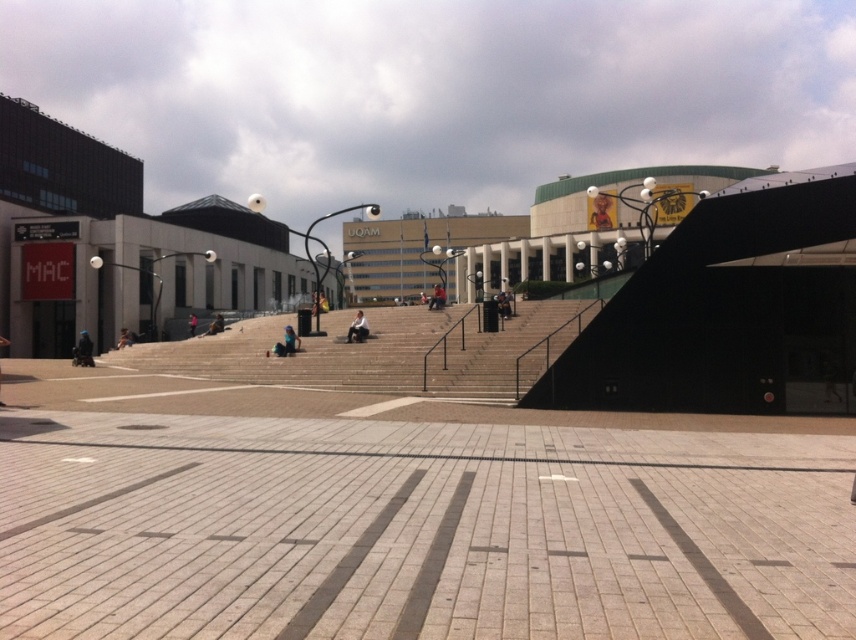
Who is positioned more to the right, dark blue jeans at center or dark blue jeans at lower left?

From the viewer's perspective, dark blue jeans at center appears more on the right side.

Is the position of dark blue jeans at center less distant than that of dark blue jeans at lower left?

Yes, it is.

The height and width of the screenshot is (640, 856). I want to click on dark blue jeans at center, so click(x=503, y=305).

Can you confirm if red fabric jacket at center is positioned above dark blue jeans at lower left?

Yes.

Can you confirm if red fabric jacket at center is positioned below dark blue jeans at lower left?

Actually, red fabric jacket at center is above dark blue jeans at lower left.

Which is behind, point (441, 305) or point (120, 340)?

Point (120, 340)

Image resolution: width=856 pixels, height=640 pixels. Find the location of `red fabric jacket at center`. red fabric jacket at center is located at coordinates (437, 298).

Can you confirm if dark blue jeans at center is smaller than blue fabric person at center?

No.

What do you see at coordinates (503, 305) in the screenshot? The width and height of the screenshot is (856, 640). I see `dark blue jeans at center` at bounding box center [503, 305].

Find the location of a particular element. The height and width of the screenshot is (640, 856). dark blue jeans at center is located at coordinates (503, 305).